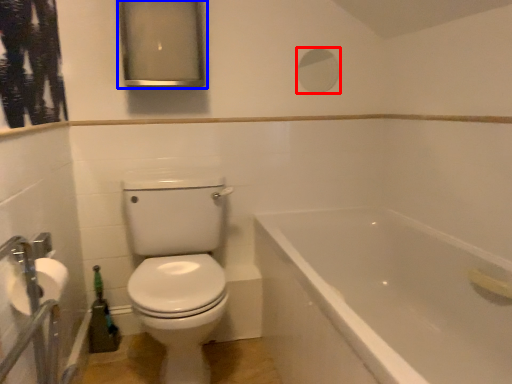
Question: Which object appears closest to the camera in this image, mirror (highlighted by a red box) or medicine cabinet (highlighted by a blue box)?

Choices:
 (A) mirror
 (B) medicine cabinet

Answer: (B)